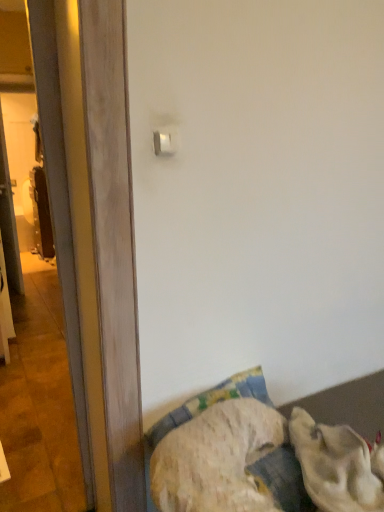
Measure the distance between point (360, 424) and camera.

Point (360, 424) and camera are 4.85 feet apart.

Measure the distance between white plastic light switch at upper center and camera.

white plastic light switch at upper center and camera are 1.15 meters apart.

Find the location of a particular element. Image resolution: width=384 pixels, height=512 pixels. white fluffy dog at lower right is located at coordinates (337, 465).

At what (x,y) coordinates should I click in order to perform the action: click on transparent glass screen door at left. Please return your answer as a coordinate pair (x, y). This screenshot has height=512, width=384. Looking at the image, I should click on (59, 205).

Image resolution: width=384 pixels, height=512 pixels. I want to click on fluffy fabric bed at lower right, so click(x=349, y=405).

Between white plastic light switch at upper center and transparent glass screen door at left, which one appears on the right side from the viewer's perspective?

white plastic light switch at upper center is more to the right.

Does white plastic light switch at upper center have a lesser width compared to transparent glass screen door at left?

Correct, the width of white plastic light switch at upper center is less than that of transparent glass screen door at left.

From the image's perspective, is white plastic light switch at upper center located beneath transparent glass screen door at left?

No, from the image's perspective, white plastic light switch at upper center is not below transparent glass screen door at left.

Is white plastic light switch at upper center taller or shorter than transparent glass screen door at left?

white plastic light switch at upper center is shorter than transparent glass screen door at left.

Would you say fluffy fabric bed at lower right is inside or outside white plastic light switch at upper center?

fluffy fabric bed at lower right lies outside white plastic light switch at upper center.

The image size is (384, 512). What are the coordinates of `light switch lying above the fluffy fabric bed at lower right (from the image's perspective)` in the screenshot? It's located at (165, 140).

From a real-world perspective, relative to white plastic light switch at upper center, is fluffy fabric bed at lower right vertically above or below?

From a real-world perspective, fluffy fabric bed at lower right is physically below white plastic light switch at upper center.

Is fluffy fabric bed at lower right positioned far away from white plastic light switch at upper center?

fluffy fabric bed at lower right is near white plastic light switch at upper center, not far away.

Which is more to the right, fluffy fabric bed at lower right or white fluffy dog at lower right?

white fluffy dog at lower right.

Is fluffy fabric bed at lower right oriented towards white fluffy dog at lower right?

No, fluffy fabric bed at lower right is not facing towards white fluffy dog at lower right.

Find the location of a particular element. This screenshot has height=512, width=384. furniture on the left of the white fluffy dog at lower right is located at coordinates (349, 405).

Which object is further away from the camera, fluffy fabric bed at lower right or white fluffy dog at lower right?

white fluffy dog at lower right is behind.

Which point is more distant from viewer, (162, 153) or (340, 503)?

The point (162, 153) is more distant.

You are a GUI agent. You are given a task and a screenshot of the screen. Output one action in this format:
    pyautogui.click(x=<x>, y=<y>)
    Task: Click on the animal in front of the white plastic light switch at upper center
    Image resolution: width=384 pixels, height=512 pixels.
    Given the screenshot: What is the action you would take?
    pyautogui.click(x=337, y=465)

From a real-world perspective, which object stands above the other?

white plastic light switch at upper center is physically above.

Does white plastic light switch at upper center turn towards white fluffy dog at lower right?

No, white plastic light switch at upper center is not aimed at white fluffy dog at lower right.

In the image, is fluffy fabric bed at lower right on the left side or the right side of transparent glass screen door at left?

fluffy fabric bed at lower right is to the right of transparent glass screen door at left.

What's the angular difference between fluffy fabric bed at lower right and transparent glass screen door at left's facing directions?

fluffy fabric bed at lower right and transparent glass screen door at left are facing 2.78 degrees away from each other.

Is fluffy fabric bed at lower right not near transparent glass screen door at left?

That's not correct — fluffy fabric bed at lower right is a little close to transparent glass screen door at left.

Identify the location of light switch positioned vertically above the white fluffy dog at lower right (from a real-world perspective). (165, 140).

Is white plastic light switch at upper center at the back of white fluffy dog at lower right?

white fluffy dog at lower right does not have its back to white plastic light switch at upper center.

Which object is positioned more to the right, white fluffy dog at lower right or white plastic light switch at upper center?

Positioned to the right is white fluffy dog at lower right.

Is white fluffy dog at lower right next to white plastic light switch at upper center?

No, white fluffy dog at lower right is not in contact with white plastic light switch at upper center.

Does point (327, 506) come in front of point (206, 402)?

That is True.

Is white fluffy dog at lower right looking in the opposite direction of fluffy fabric bed at lower right?

Yes.

Considering the positions of objects white fluffy dog at lower right and fluffy fabric bed at lower right in the image provided, who is more to the left, white fluffy dog at lower right or fluffy fabric bed at lower right?

From the viewer's perspective, fluffy fabric bed at lower right appears more on the left side.

Are white fluffy dog at lower right and fluffy fabric bed at lower right making contact?

No, white fluffy dog at lower right is not making contact with fluffy fabric bed at lower right.

Identify the location of light switch positioned vertically above the transparent glass screen door at left (from a real-world perspective). The width and height of the screenshot is (384, 512). (165, 140).

Image resolution: width=384 pixels, height=512 pixels. What are the coordinates of `furniture in front of the white plastic light switch at upper center` in the screenshot? It's located at (349, 405).

Estimate the real-world distances between objects in this image. Which object is further from white fluffy dog at lower right, fluffy fabric bed at lower right or white plastic light switch at upper center?

white plastic light switch at upper center.

Looking at the image, which one is located closer to white fluffy dog at lower right, white plastic light switch at upper center or transparent glass screen door at left?

Among the two, transparent glass screen door at left is located nearer to white fluffy dog at lower right.

Looking at the image, which one is located further to fluffy fabric bed at lower right, white plastic light switch at upper center or transparent glass screen door at left?

white plastic light switch at upper center lies further to fluffy fabric bed at lower right than the other object.

From the image, which object appears to be nearer to white plastic light switch at upper center, transparent glass screen door at left or white fluffy dog at lower right?

transparent glass screen door at left is closer to white plastic light switch at upper center.

Based on their spatial positions, is fluffy fabric bed at lower right or white fluffy dog at lower right further from transparent glass screen door at left?

white fluffy dog at lower right.

Based on their spatial positions, is white fluffy dog at lower right or white plastic light switch at upper center further from transparent glass screen door at left?

white fluffy dog at lower right is positioned further to the anchor transparent glass screen door at left.

Looking at the image, which one is located closer to transparent glass screen door at left, white plastic light switch at upper center or fluffy fabric bed at lower right?

white plastic light switch at upper center lies closer to transparent glass screen door at left than the other object.

Considering their positions, is white fluffy dog at lower right positioned closer to white plastic light switch at upper center than transparent glass screen door at left?

transparent glass screen door at left is closer to white plastic light switch at upper center.

Locate an element on the screen. The height and width of the screenshot is (512, 384). screen door between white plastic light switch at upper center and fluffy fabric bed at lower right vertically is located at coordinates (59, 205).

Identify the location of furniture between transparent glass screen door at left and white fluffy dog at lower right. This screenshot has height=512, width=384. (349, 405).

You are a GUI agent. You are given a task and a screenshot of the screen. Output one action in this format:
    pyautogui.click(x=<x>, y=<y>)
    Task: Click on the animal between white plastic light switch at upper center and fluffy fabric bed at lower right vertically
    Image resolution: width=384 pixels, height=512 pixels.
    Given the screenshot: What is the action you would take?
    pyautogui.click(x=337, y=465)

Where is `screen door between white plastic light switch at upper center and white fluffy dog at lower right from top to bottom`? This screenshot has height=512, width=384. screen door between white plastic light switch at upper center and white fluffy dog at lower right from top to bottom is located at coordinates (59, 205).